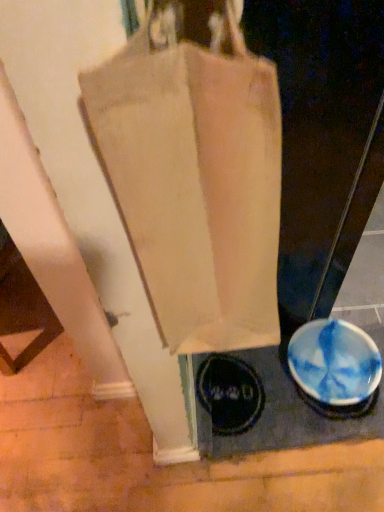
Image resolution: width=384 pixels, height=512 pixels. What do you see at coordinates (195, 172) in the screenshot?
I see `canvas bag at center` at bounding box center [195, 172].

In order to face canvas bag at center, should I rotate leftwards or rightwards?

Rotate right and turn 3.451 degrees.

Locate an element on the screen. This screenshot has height=512, width=384. canvas bag at center is located at coordinates (195, 172).

Describe the element at coordinates (334, 362) in the screenshot. This screenshot has width=384, height=512. I see `blue glossy bowl at lower right` at that location.

Where is `blue glossy bowl at lower right`? blue glossy bowl at lower right is located at coordinates (334, 362).

You are a GUI agent. You are given a task and a screenshot of the screen. Output one action in this format:
    pyautogui.click(x=<x>, y=<y>)
    Task: Click on the canvas bag at center
    This screenshot has height=512, width=384.
    Given the screenshot: What is the action you would take?
    pyautogui.click(x=195, y=172)

Considering the positions of objects blue glossy bowl at lower right and canvas bag at center in the image provided, who is more to the left, blue glossy bowl at lower right or canvas bag at center?

Positioned to the left is canvas bag at center.

Between blue glossy bowl at lower right and canvas bag at center, which one is positioned in front?

Positioned in front is canvas bag at center.

Which is closer to the camera, (345, 350) or (261, 113)?

The point (261, 113) is more forward.

From the image's perspective, which is below, blue glossy bowl at lower right or canvas bag at center?

blue glossy bowl at lower right appears lower in the image.

From a real-world perspective, which is physically above, blue glossy bowl at lower right or canvas bag at center?

From a 3D spatial view, canvas bag at center is above.

Is blue glossy bowl at lower right wider or thinner than canvas bag at center?

Clearly, blue glossy bowl at lower right has more width compared to canvas bag at center.

Considering the sizes of blue glossy bowl at lower right and canvas bag at center in the image, is blue glossy bowl at lower right taller or shorter than canvas bag at center?

blue glossy bowl at lower right is shorter than canvas bag at center.

Between blue glossy bowl at lower right and canvas bag at center, which one has smaller size?

With smaller size is blue glossy bowl at lower right.

Is blue glossy bowl at lower right located outside canvas bag at center?

Yes.

Does blue glossy bowl at lower right touch canvas bag at center?

They are not placed beside each other.

Could you tell me if blue glossy bowl at lower right is turned towards canvas bag at center?

No, blue glossy bowl at lower right does not turn towards canvas bag at center.

Can you tell me how much blue glossy bowl at lower right and canvas bag at center differ in facing direction?

The angular difference between blue glossy bowl at lower right and canvas bag at center is 86.9 degrees.

Locate an element on the screen. handbag on the left of the blue glossy bowl at lower right is located at coordinates (195, 172).

Is canvas bag at center to the left of blue glossy bowl at lower right from the viewer's perspective?

Correct, you'll find canvas bag at center to the left of blue glossy bowl at lower right.

Is the depth of canvas bag at center greater than that of blue glossy bowl at lower right?

No.

Does point (276, 289) come closer to viewer compared to point (322, 332)?

Yes, it is.

From the image's perspective, is canvas bag at center located beneath blue glossy bowl at lower right?

No, from the image's perspective, canvas bag at center is not below blue glossy bowl at lower right.

From a real-world perspective, which object stands above the other?

From a 3D spatial view, canvas bag at center is above.

Is canvas bag at center thinner than blue glossy bowl at lower right?

Yes.

Between canvas bag at center and blue glossy bowl at lower right, which one has more height?

canvas bag at center.

Based on the photo, is canvas bag at center bigger than blue glossy bowl at lower right?

Yes, canvas bag at center is bigger than blue glossy bowl at lower right.

Is blue glossy bowl at lower right inside canvas bag at center?

No, blue glossy bowl at lower right is not a part of canvas bag at center.

Does canvas bag at center touch blue glossy bowl at lower right?

No, canvas bag at center is not in contact with blue glossy bowl at lower right.

Is canvas bag at center positioned with its back to blue glossy bowl at lower right?

No, canvas bag at center is not facing the opposite direction of blue glossy bowl at lower right.

This screenshot has height=512, width=384. In the image, there is a blue glossy bowl at lower right. What are the coordinates of `handbag above it (from the image's perspective)` in the screenshot? It's located at (195, 172).

Where is `bowl to the right of canvas bag at center`? The height and width of the screenshot is (512, 384). bowl to the right of canvas bag at center is located at coordinates (334, 362).

Identify the location of handbag in front of the blue glossy bowl at lower right. This screenshot has width=384, height=512. (195, 172).